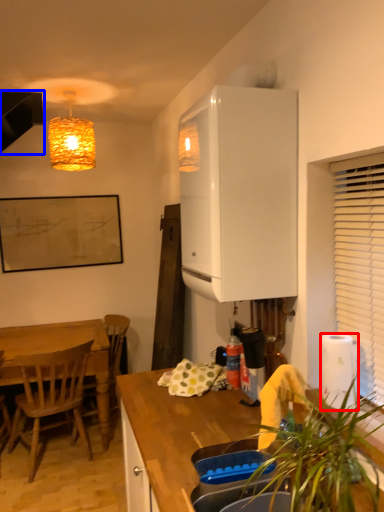
Question: Among these objects, which one is farthest to the camera, paper towel (highlighted by a red box) or exhaust hood (highlighted by a blue box)?

Choices:
 (A) paper towel
 (B) exhaust hood

Answer: (B)